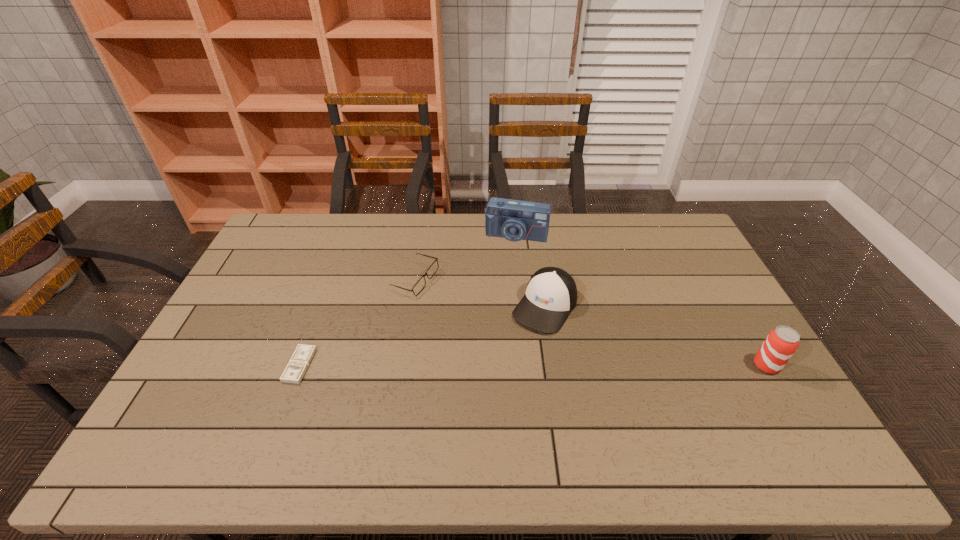
Locate an element on the screen. This screenshot has width=960, height=540. free location located with the lenses facing outward on the fourth object from right to left is located at coordinates (439, 310).

Where is `free space located 0.330m with the lenses facing outward on the fourth object from right to left`? free space located 0.330m with the lenses facing outward on the fourth object from right to left is located at coordinates (485, 363).

Where is `free space located on the lens of the farthest object`? This screenshot has width=960, height=540. free space located on the lens of the farthest object is located at coordinates (501, 276).

At what (x,y) coordinates should I click in order to perform the action: click on vacant region located on the lens of the farthest object. Please return your answer as a coordinate pair (x, y). This screenshot has height=540, width=960. Looking at the image, I should click on (498, 284).

Locate an element on the screen. This screenshot has height=540, width=960. vacant space positioned 0.320m on the lens of the farthest object is located at coordinates (492, 304).

I want to click on vacant area located 0.200m on the front panel of the cap, so click(x=498, y=379).

I want to click on blank space located on the front panel of the cap, so click(x=483, y=401).

Locate an element on the screen. The width and height of the screenshot is (960, 540). free space located 0.120m on the front panel of the cap is located at coordinates (512, 359).

Find the location of `object that is at the far edge`. object that is at the far edge is located at coordinates (515, 220).

Where is `object situated at the right edge`? object situated at the right edge is located at coordinates (781, 343).